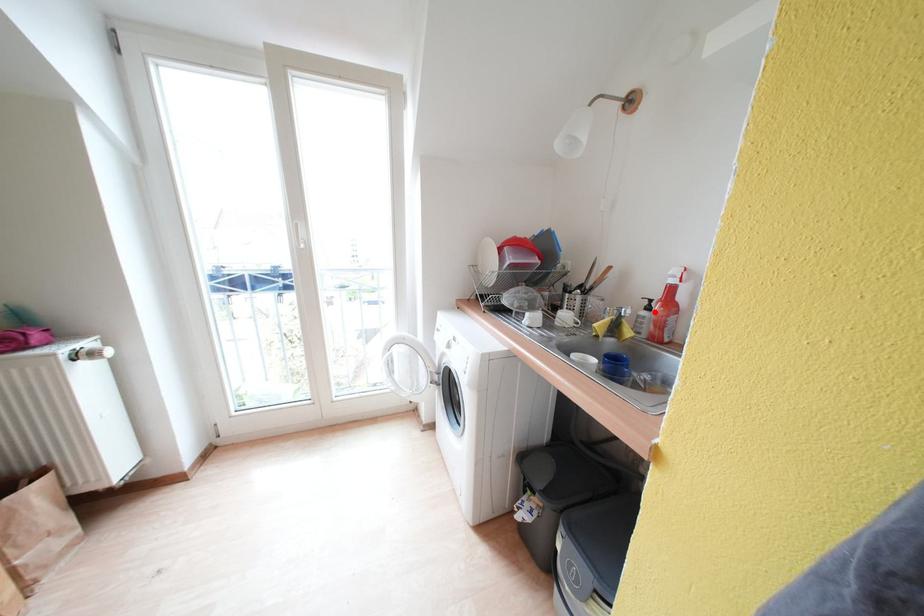
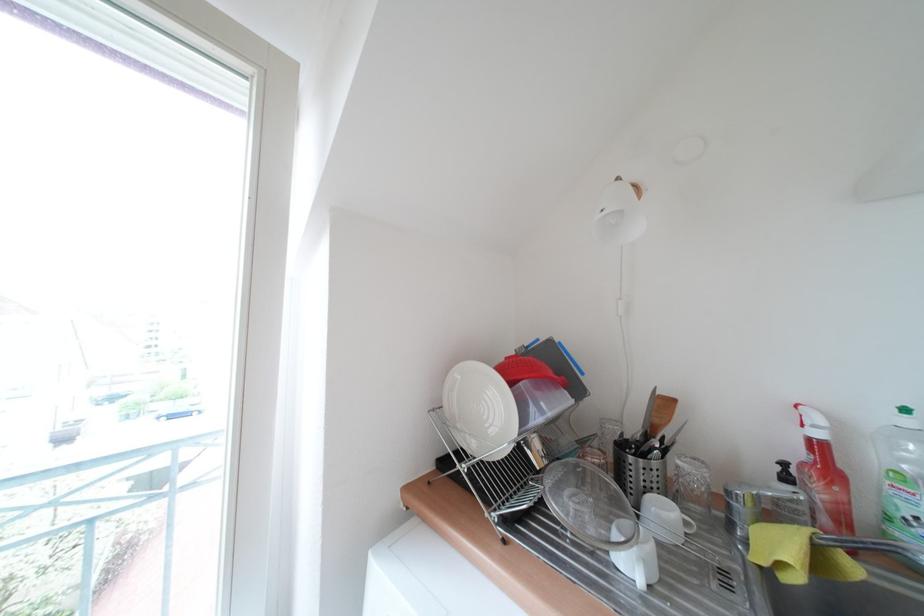
The point at the highlighted location is marked in the first image. Where is the corresponding point in the second image?

(793, 482)